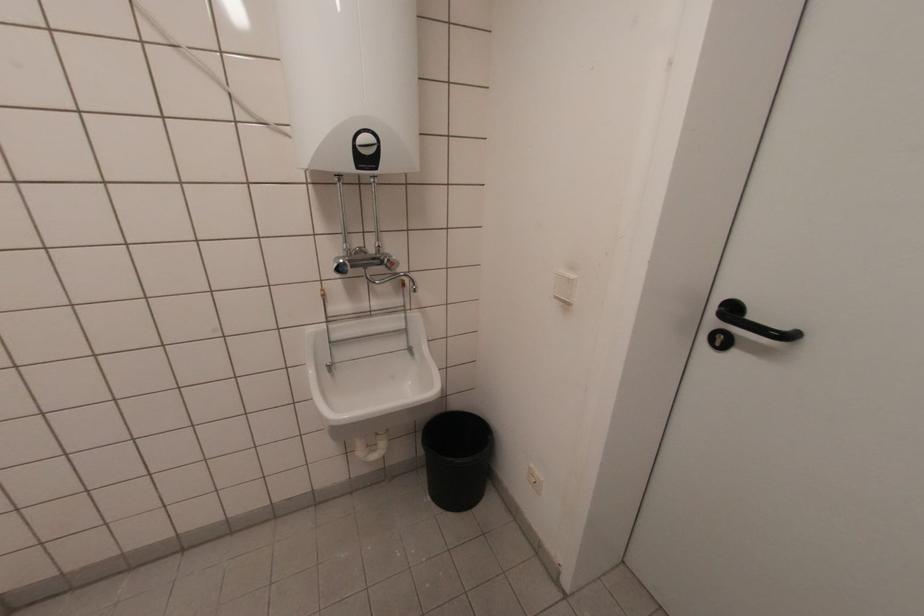
What do you see at coordinates (564, 286) in the screenshot? The width and height of the screenshot is (924, 616). I see `a white light switch` at bounding box center [564, 286].